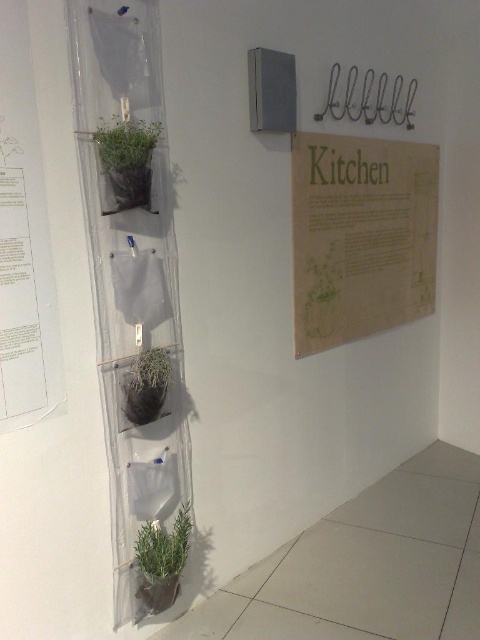
You are a gardener who needs to water two plants. You have a watering can that can reach up to 20 inches. You are standing in front of the green matte plant at lower center and the green matte plant at center. Can you water both plants without moving the watering can?

The green matte plant at lower center and green matte plant at center are 21.71 inches apart, which is beyond the 20 inches reach of the watering can. Therefore, you cannot water both plants without moving the watering can.

You are an interior designer planning to add a new decorative item between the burlap paper sign at upper right and the green matte plant at center. The item you want to place is 3 feet wide. Based on the space between them, will the item fit?

The distance between the burlap paper sign at upper right and the green matte plant at center is 4.49 feet. Since the item is 3 feet wide, it will fit as there is enough space.